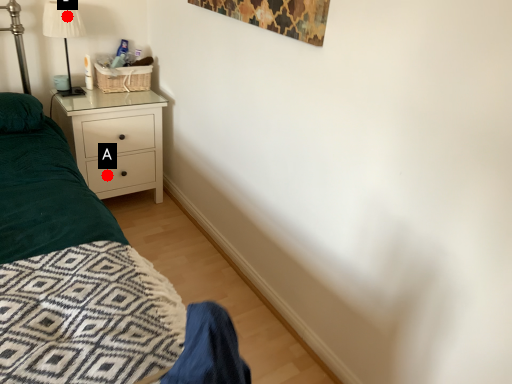
Question: Two points are circled on the image, labeled by A and B beside each circle. Which point appears closest to the camera in this image?

Choices:
 (A) A is closer
 (B) B is closer

Answer: (B)